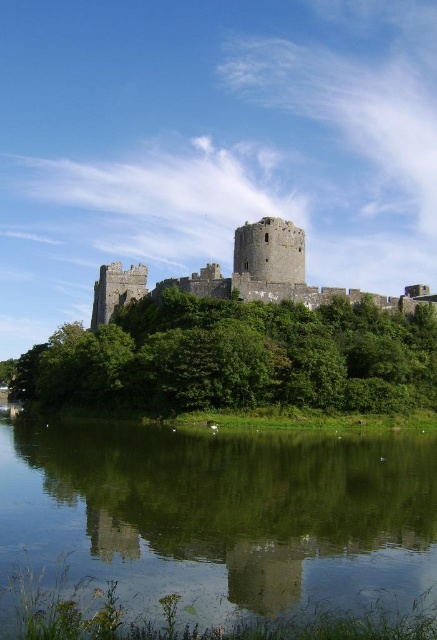
Does green reflective water at lower center appear under stone medieval castle at center?

Yes.

Which is more to the left, green reflective water at lower center or stone medieval castle at center?

From the viewer's perspective, green reflective water at lower center appears more on the left side.

This screenshot has height=640, width=437. Find the location of `green reflective water at lower center`. green reflective water at lower center is located at coordinates (221, 515).